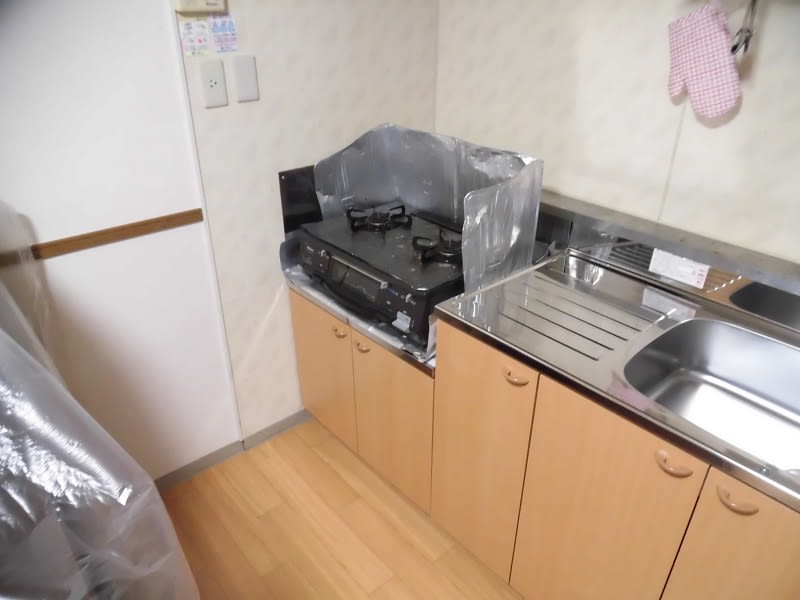
Where is `stove`? stove is located at coordinates (356, 285).